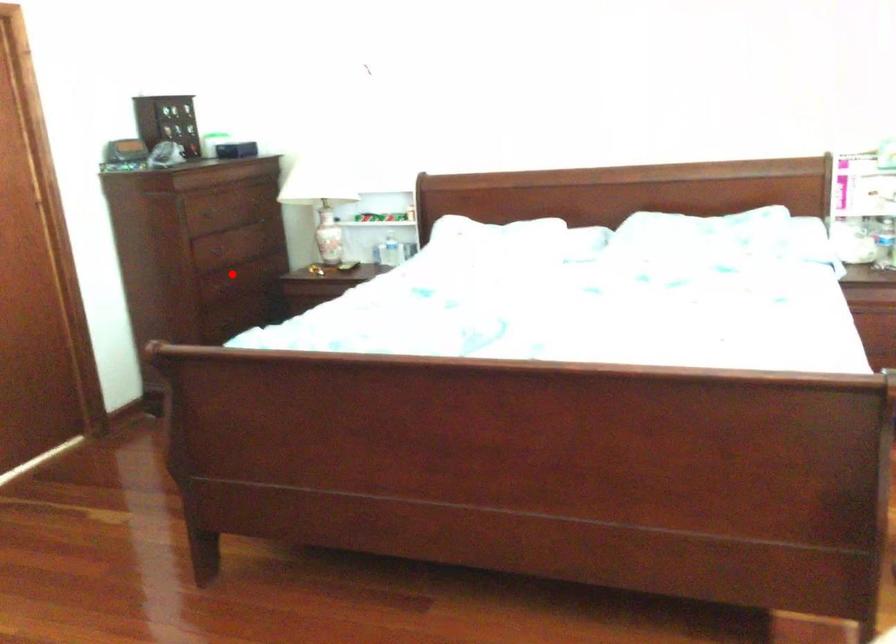
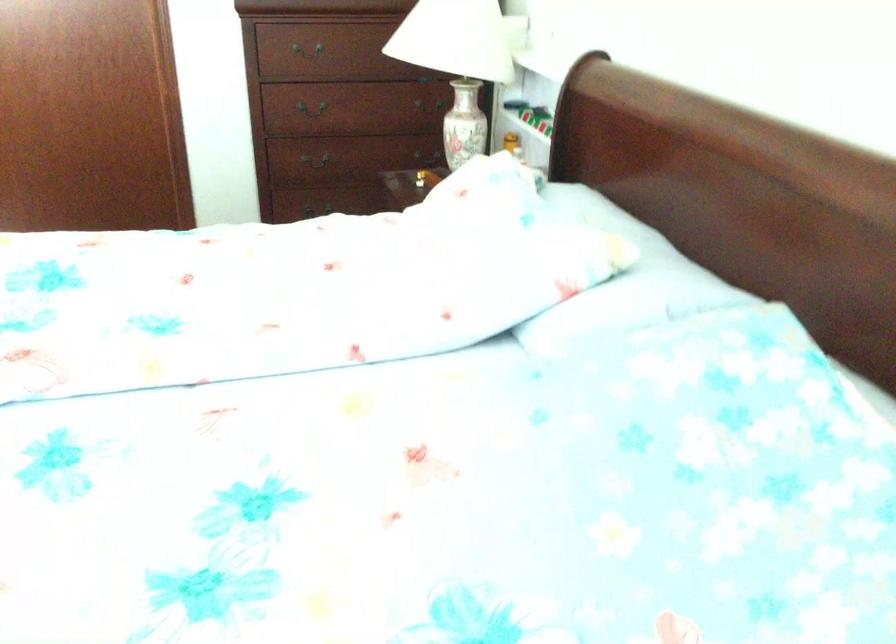
In the second image, find the point that corresponds to the highlighted location in the first image.

(313, 108)